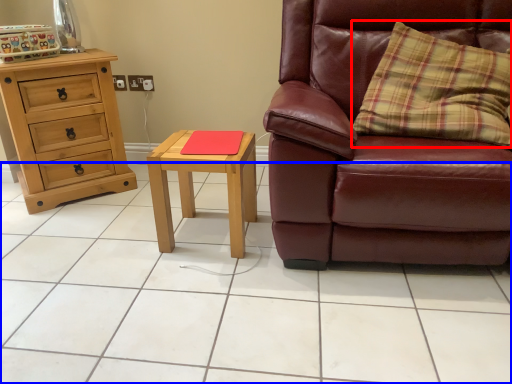
Question: Among these objects, which one is nearest to the camera, pillow (highlighted by a red box) or ceramic tile (highlighted by a blue box)?

Choices:
 (A) pillow
 (B) ceramic tile

Answer: (B)